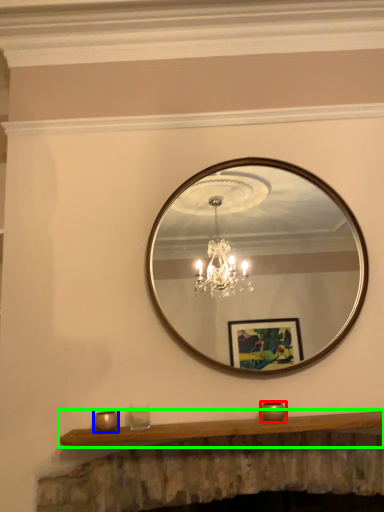
Question: Based on their relative distances, which object is nearer to candle holder (highlighted by a red box)? Choose from candle holder (highlighted by a blue box) and mantle (highlighted by a green box).

Choices:
 (A) candle holder
 (B) mantle

Answer: (B)